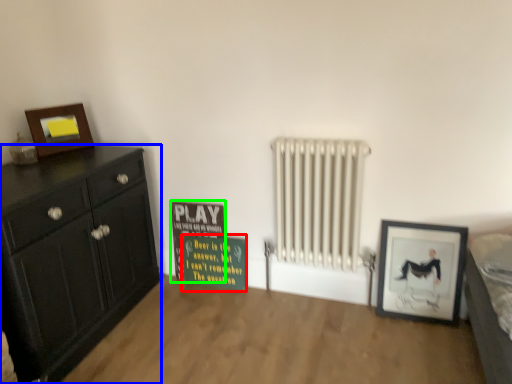
Question: Estimate the real-world distances between objects in this image. Which object is farther from warning sign (highlighted by a red box), chest of drawers (highlighted by a blue box) or bulletin board (highlighted by a green box)?

Choices:
 (A) chest of drawers
 (B) bulletin board

Answer: (A)